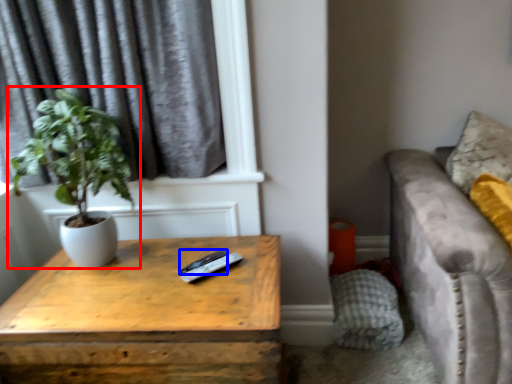
Question: Which of the following is the farthest to the observer, houseplant (highlighted by a red box) or remote (highlighted by a blue box)?

Choices:
 (A) houseplant
 (B) remote

Answer: (B)